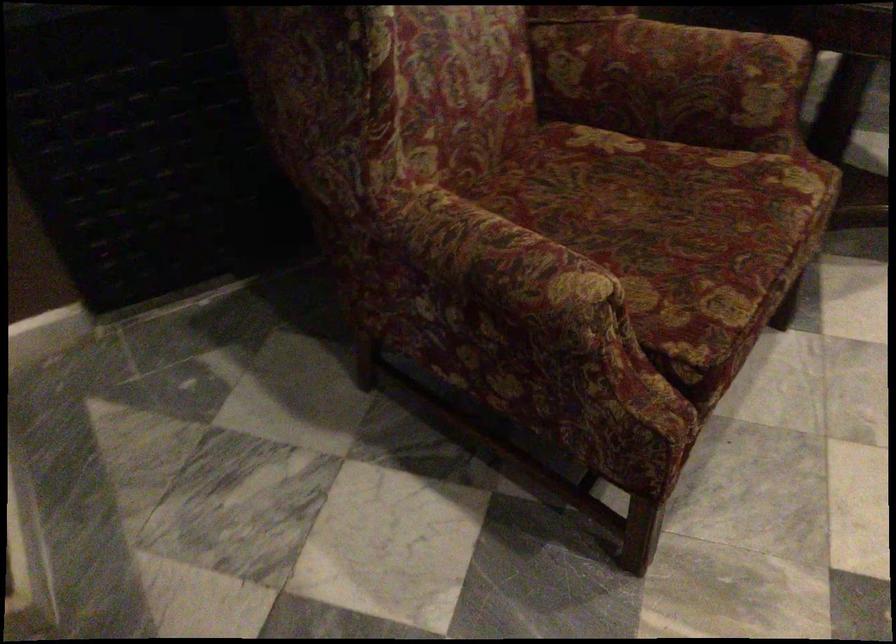
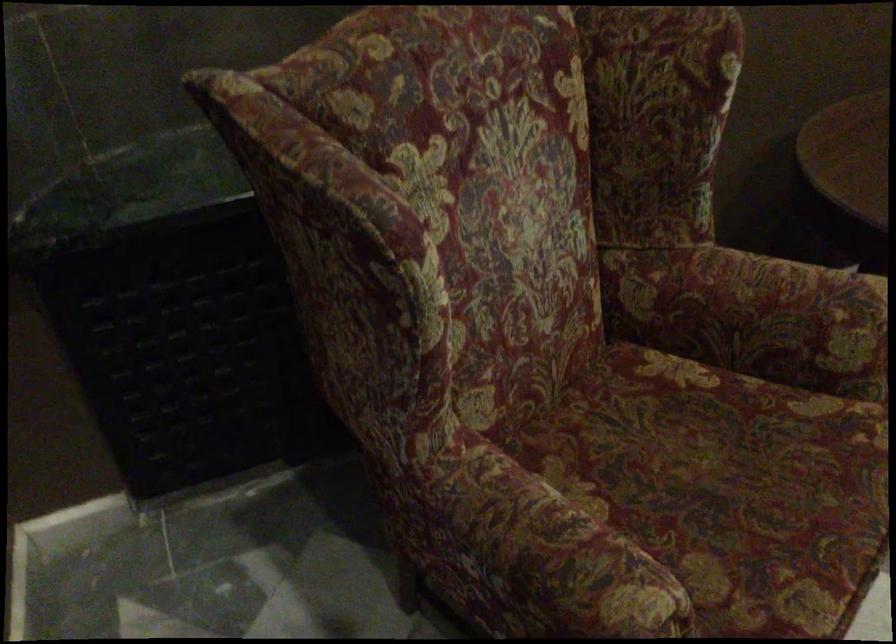
Find the pixel in the second image that matches (x=653, y=225) in the first image.

(726, 486)